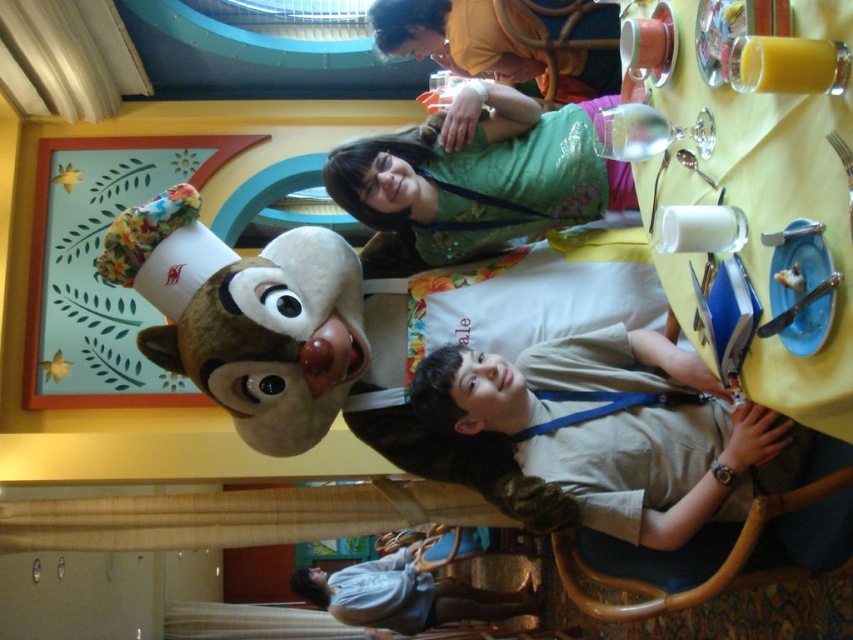
You are a photographer who needs to capture a photo of the child and the fluffy brown plush toy at upper left. Based on their positions, can you determine if the plush toy will be visible in the photo if you focus on the child?

The fluffy brown plush toy at upper left is located at point (245, 316), which means it is within the frame if the photographer focuses on the child. Therefore, the plush toy will be visible in the photo.

From the picture: You are standing at the entrance of the themed restaurant and see the light brown uniform at center and the denim shirt at lower center. Which object is closer to you?

The denim shirt at lower center is closer to you because it is only 36.16 feet away from the light brown uniform at center, so the denim shirt at lower center is nearer than the light brown uniform at center.

You are a customer in a restaurant and you see the green fabric shirt at upper center and the denim shirt at lower center. Which one is closer to the ceiling?

The green fabric shirt at upper center is closer to the ceiling because it is positioned over the denim shirt at lower center.